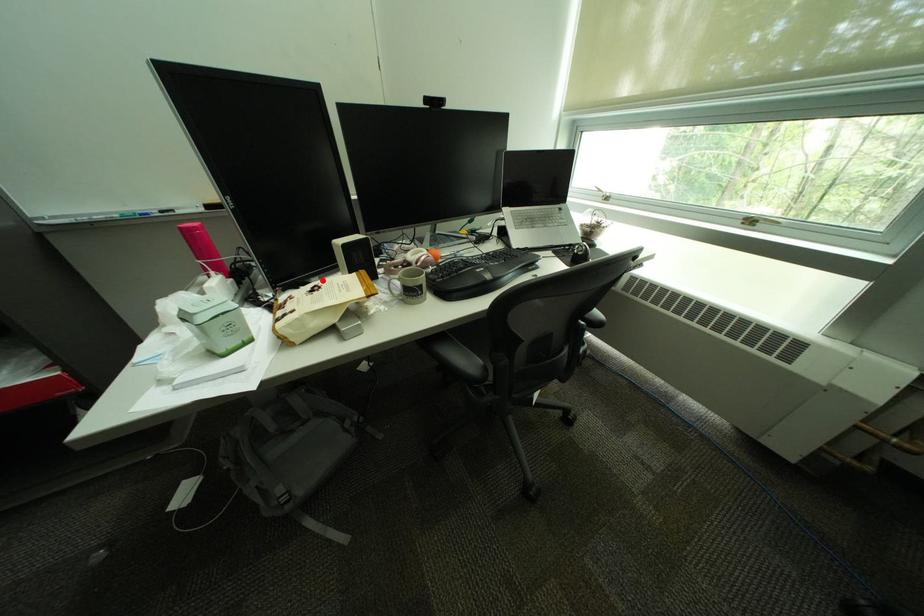
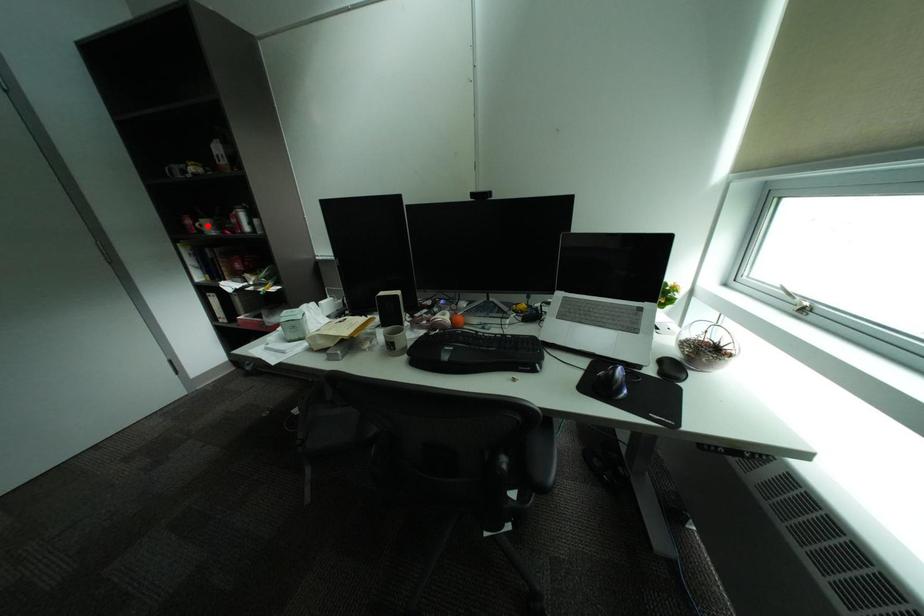
I am providing you with two images of the same scene from different viewpoints. A red point is marked on the first image and another point is marked on the second image. Is the marked point in image1 the same physical position as the marked point in image2?

No